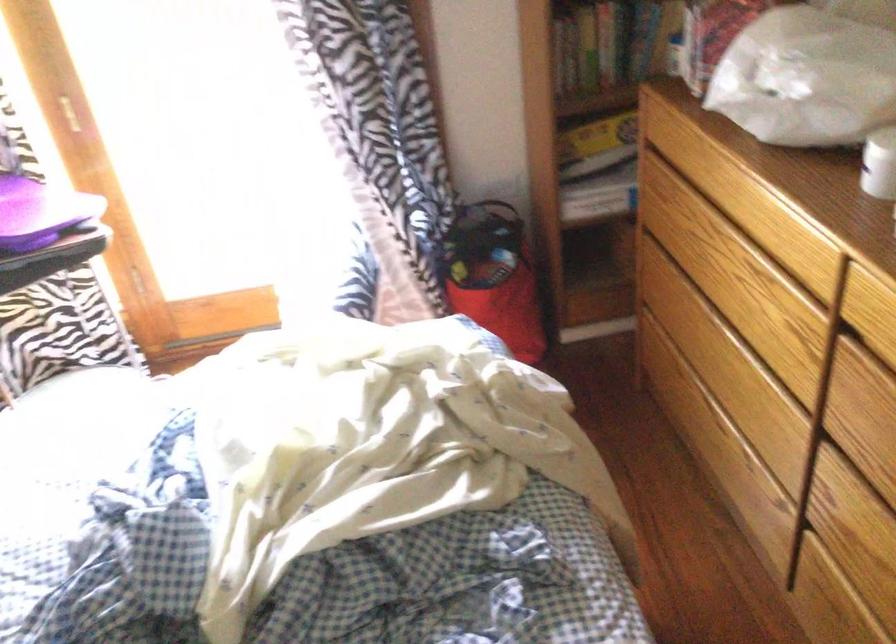
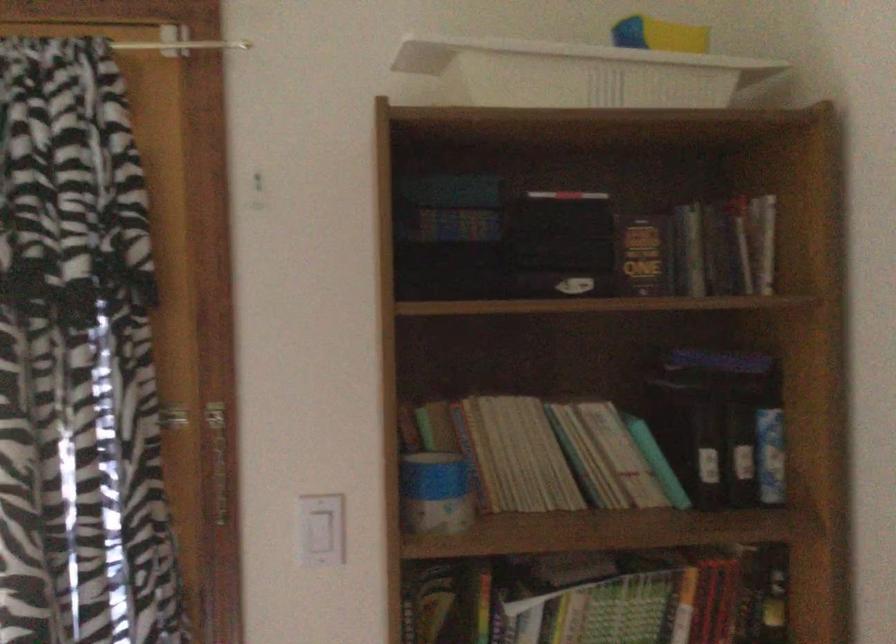
Question: The first image is from the beginning of the video and the second image is from the end. How did the camera likely rotate when shooting the video?

Choices:
 (A) Left
 (B) Right
 (C) Up
 (D) Down

Answer: (C)